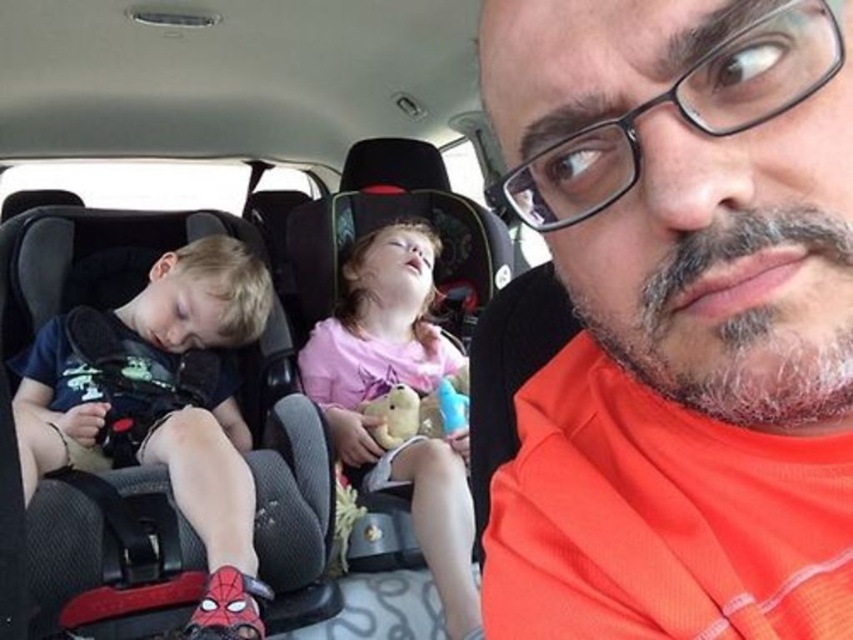
Question: Does orange fabric shirt at upper right have a lesser width compared to fluffy beige teddy bear at center?

Choices:
 (A) yes
 (B) no

Answer: (B)

Question: Can you confirm if orange fabric shirt at upper right is thinner than matte black shirt at left?

Choices:
 (A) no
 (B) yes

Answer: (B)

Question: Is orange fabric shirt at upper right thinner than pink fabric teddy bear at center?

Choices:
 (A) yes
 (B) no

Answer: (A)

Question: Which object is the farthest from the matte black shirt at left?

Choices:
 (A) orange fabric shirt at upper right
 (B) fluffy beige teddy bear at center

Answer: (A)

Question: Which of the following is the closest to the observer?

Choices:
 (A) pink fabric teddy bear at center
 (B) orange fabric shirt at upper right

Answer: (B)

Question: Which object appears closest to the camera in this image?

Choices:
 (A) orange fabric shirt at upper right
 (B) pink fabric teddy bear at center
 (C) fluffy beige teddy bear at center

Answer: (A)